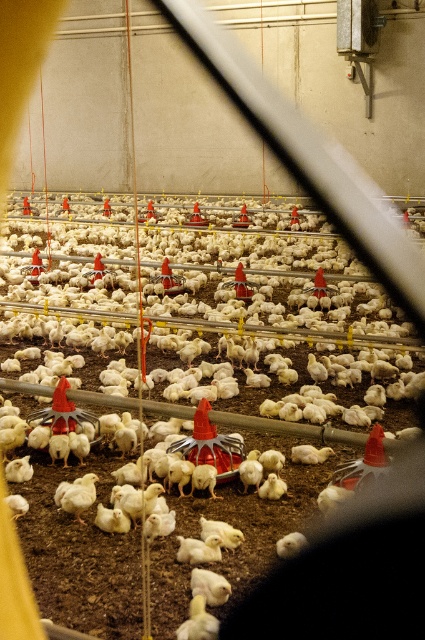
Is point (85, 220) more distant than point (289, 532)?

Yes, it is.

Is white matte chicken at center smaller than white fluffy chicken at center?

Actually, white matte chicken at center might be larger than white fluffy chicken at center.

Identify the location of white matte chicken at center. The width and height of the screenshot is (425, 640). (82, 248).